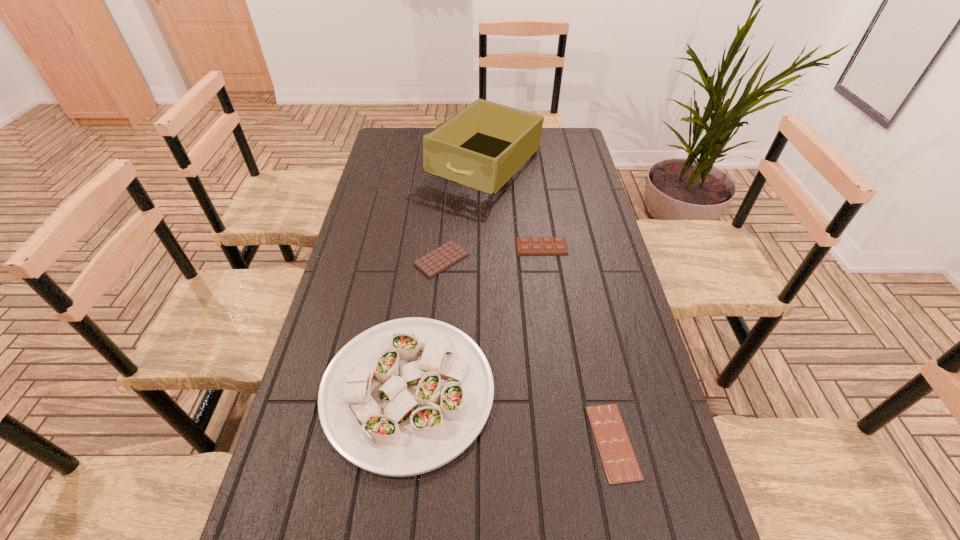
Where is `vacant space positioned 0.300m on the front of the third tallest object`? The image size is (960, 540). vacant space positioned 0.300m on the front of the third tallest object is located at coordinates (554, 330).

This screenshot has height=540, width=960. What are the coordinates of `free spot located on the back of the leftmost chocolate bar` in the screenshot? It's located at (445, 209).

Locate an element on the screen. The width and height of the screenshot is (960, 540). vacant space located on the right of the shortest object is located at coordinates (660, 442).

This screenshot has height=540, width=960. In order to click on object that is at the far edge in this screenshot , I will do `click(482, 147)`.

Locate an element on the screen. This screenshot has width=960, height=540. object at the left edge is located at coordinates [405, 397].

Find the location of `free space at the left edge`. free space at the left edge is located at coordinates (314, 469).

In the image, there is a desktop. At what (x,y) coordinates should I click in order to perform the action: click on vacant space at the right edge. Please return your answer as a coordinate pair (x, y). The image size is (960, 540). Looking at the image, I should click on (570, 187).

Image resolution: width=960 pixels, height=540 pixels. Identify the location of free space at the far left corner. (408, 144).

Where is `empty space that is in between the second tallest object and the shortest chocolate bar`? Image resolution: width=960 pixels, height=540 pixels. empty space that is in between the second tallest object and the shortest chocolate bar is located at coordinates (511, 416).

Identify the location of free spot between the tallest object and the third shortest object. (514, 206).